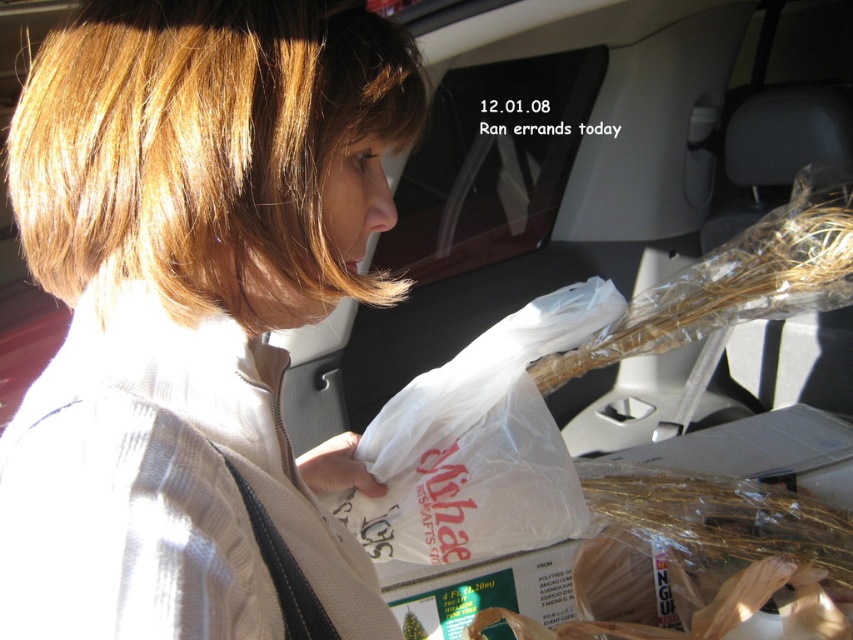
You are a photographer taking a picture of the light brown hair at upper left and the white plastic grocery bag at center. Which object will appear bigger in your photo?

The light brown hair at upper left will appear bigger in the photo since it is larger in size than the white plastic grocery bag at center.

You are a passenger sitting in the back seat of the car. You want to reach the point labeled as point (265, 64) and the point labeled as point (350, 525). Which point is closer to you?

Point (350, 525) is further away from you than point (265, 64). Therefore, point (265, 64) is closer to you.

You are a photographer trying to capture the white plastic grocery bag at center without any obstructions. Based on the scene, is the light brown hair at upper left blocking your view of the bag?

Yes, the light brown hair at upper left is blocking the view of the white plastic grocery bag at center because it is positioned in front of it.